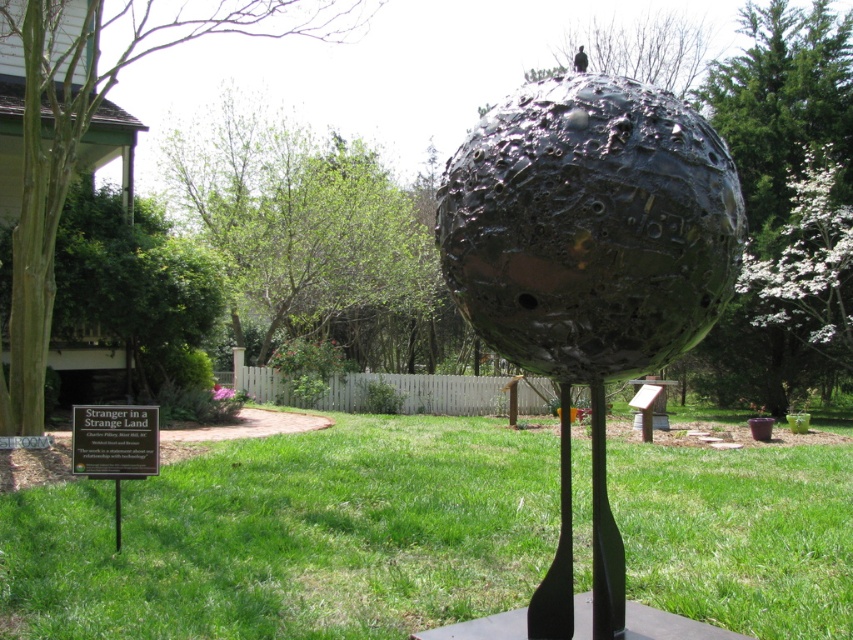
Question: Does green grass at center appear over shiny metallic sphere at center?

Choices:
 (A) no
 (B) yes

Answer: (A)

Question: Is green grass at center below shiny metallic sphere at center?

Choices:
 (A) no
 (B) yes

Answer: (B)

Question: Is green grass at center above shiny metallic sphere at center?

Choices:
 (A) no
 (B) yes

Answer: (A)